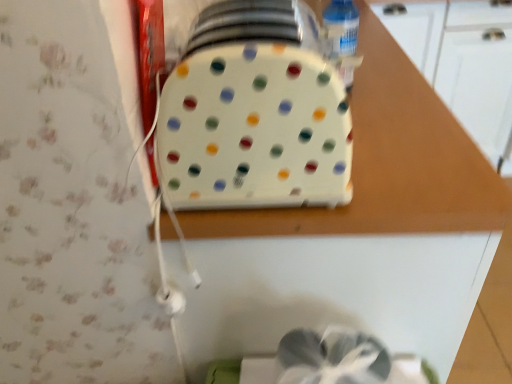
Locate an element on the screen. This screenshot has height=384, width=512. spots to the right of clear plastic bottle at upper right is located at coordinates (393, 89).